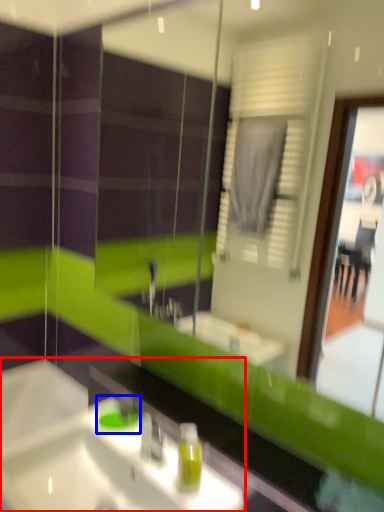
Question: Which of the following is the closest to the observer, sink (highlighted by a red box) or teal (highlighted by a blue box)?

Choices:
 (A) sink
 (B) teal

Answer: (A)